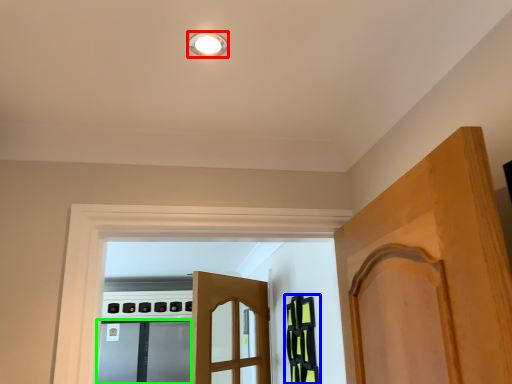
Question: Which object is positioned closest to light fixture (highlighted by a red box)? Select from cabinetry (highlighted by a blue box) and screen door (highlighted by a green box).

Choices:
 (A) cabinetry
 (B) screen door

Answer: (A)